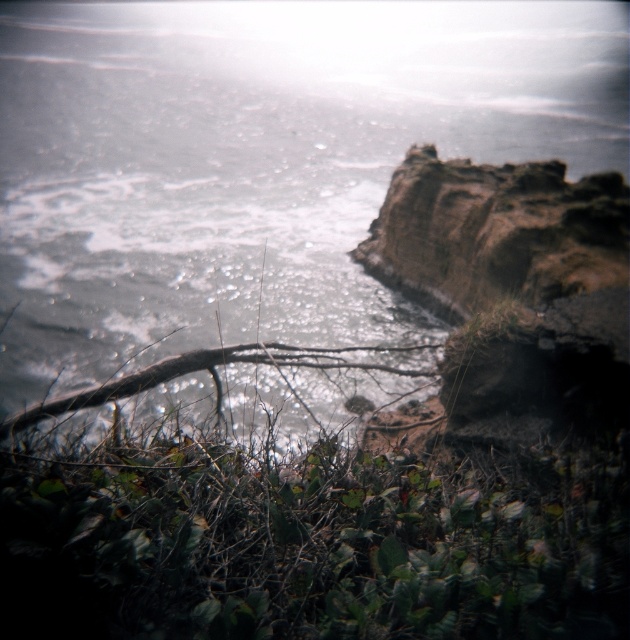
You are a hiker who has just reached the edge of the cliff. You see the glistening water at cliff edge and the green leafy vegetation at center. Which object is closer to you as you stand at the cliff edge?

The glistening water at cliff edge is closer to you since it is positioned over the green leafy vegetation at center, meaning it is in front of the vegetation.

Based on the scene described, which object occupies a greater area in the image? Please consider the glistening water at cliff edge and the green leafy vegetation at center in your answer.

The glistening water at cliff edge is larger in size than the green leafy vegetation at center, so it occupies a greater area in the image.